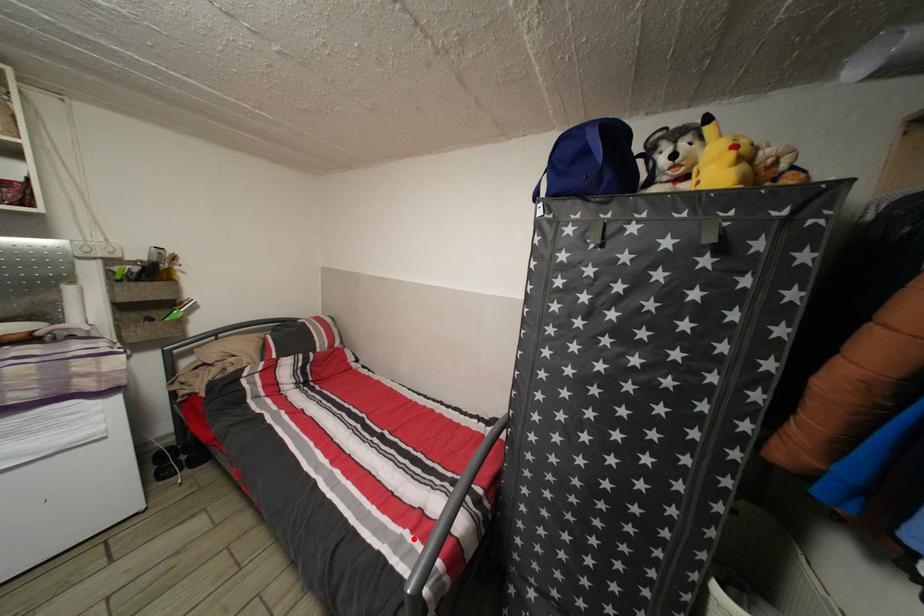
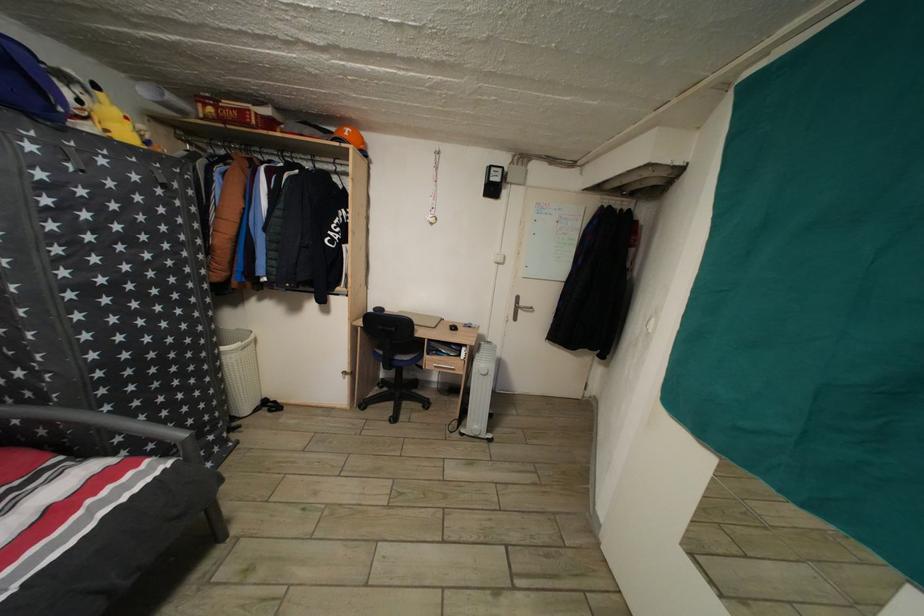
In the second image, find the point that corresponds to the highlighted location in the first image.

(96, 508)